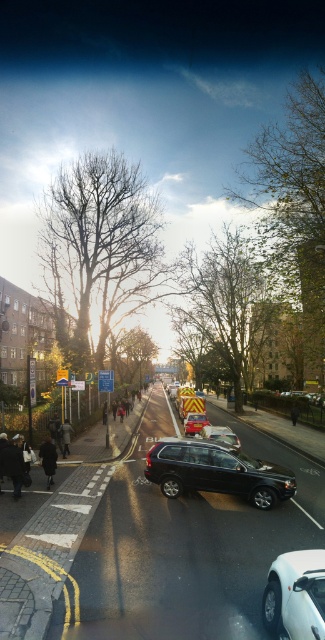
You are a pedestrian standing at the edge of the road. You see the shiny black suv at center and the white glossy car at lower right. Which vehicle is closer to you?

The shiny black suv at center is positioned under the white glossy car at lower right, which means the white glossy car at lower right is closer to you.